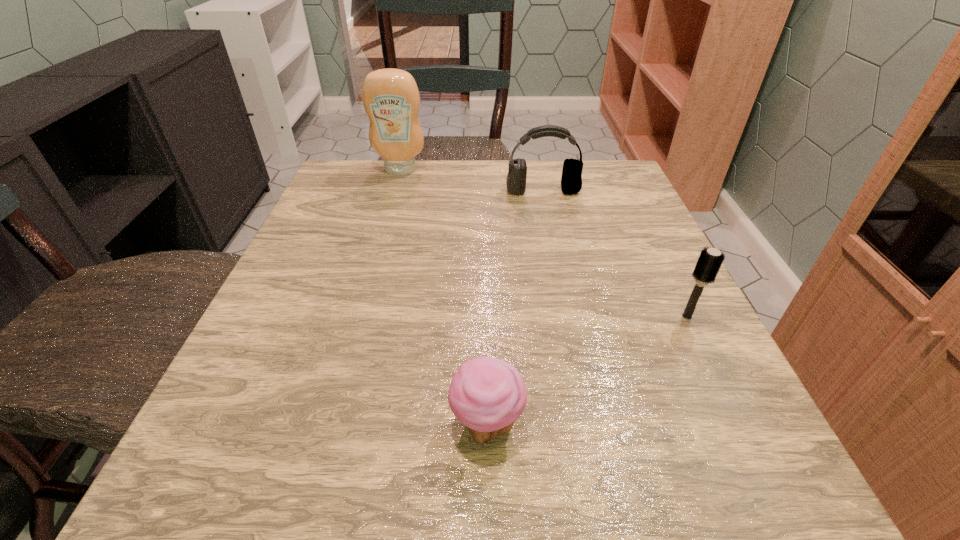
Find the location of a particular element. free space located 0.240m on the front of the hairbrush is located at coordinates (763, 472).

I want to click on free region located on the back of the cupcake, so click(x=485, y=302).

Where is `condiment that is at the far edge`? condiment that is at the far edge is located at coordinates (391, 99).

The height and width of the screenshot is (540, 960). In order to click on headset located in the far edge section of the desktop in this screenshot , I will do `click(571, 181)`.

I want to click on object present at the near edge, so click(x=487, y=395).

At what (x,y) coordinates should I click in order to perform the action: click on object positioned at the left edge. Please return your answer as a coordinate pair (x, y). This screenshot has width=960, height=540. Looking at the image, I should click on (391, 99).

Image resolution: width=960 pixels, height=540 pixels. In order to click on headset that is at the right edge in this screenshot , I will do pos(571,181).

Where is `hairbrush located at the right edge`? This screenshot has height=540, width=960. hairbrush located at the right edge is located at coordinates (710, 260).

Locate an element on the screen. object situated at the far left corner is located at coordinates pyautogui.click(x=391, y=99).

Where is `object located at the far right corner`? Image resolution: width=960 pixels, height=540 pixels. object located at the far right corner is located at coordinates (571, 181).